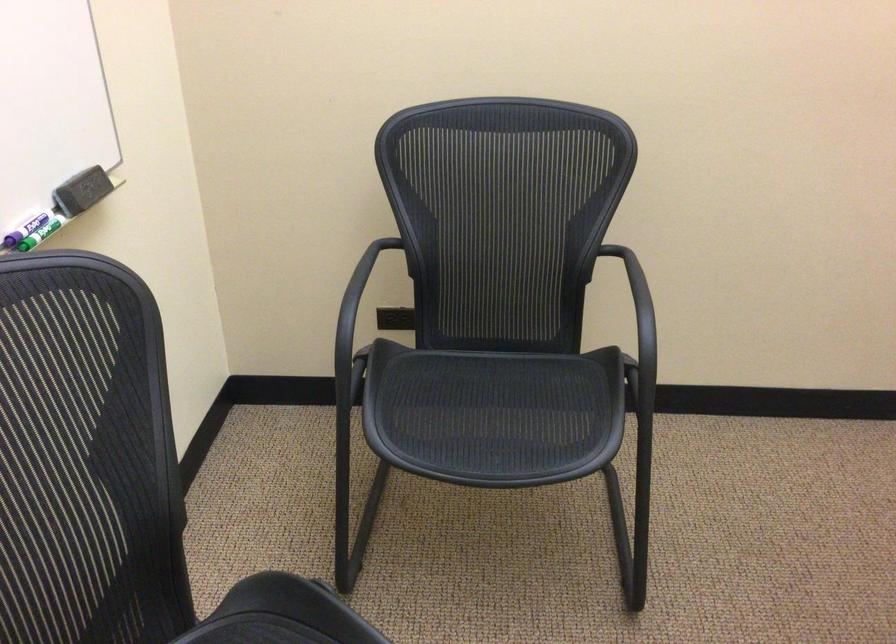
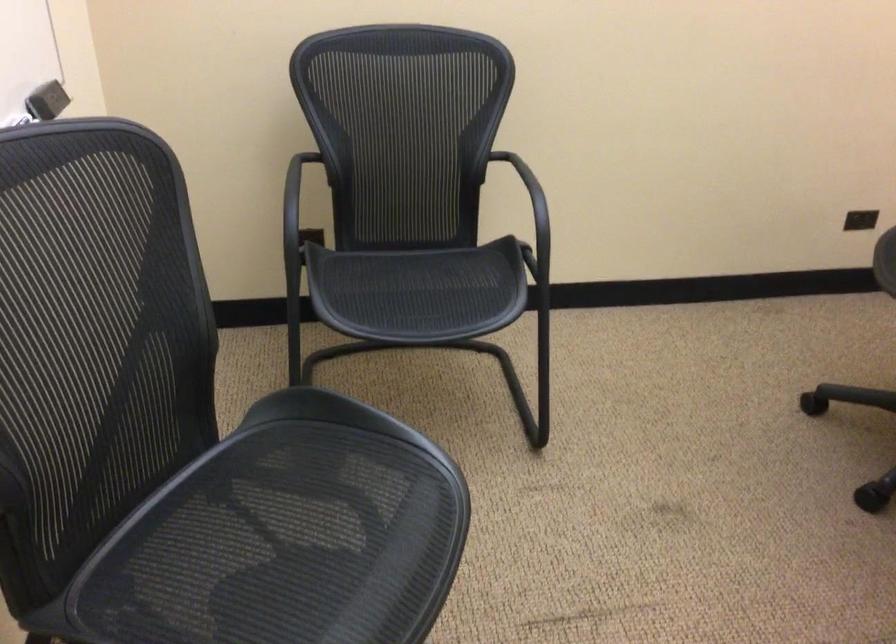
Question: I am providing you with two images of the same scene from different viewpoints. Please identify which objects are invisible in image2.

Choices:
 (A) small black object
 (B) chair armrest
 (C) chair sitting surface
 (D) none of these

Answer: (D)